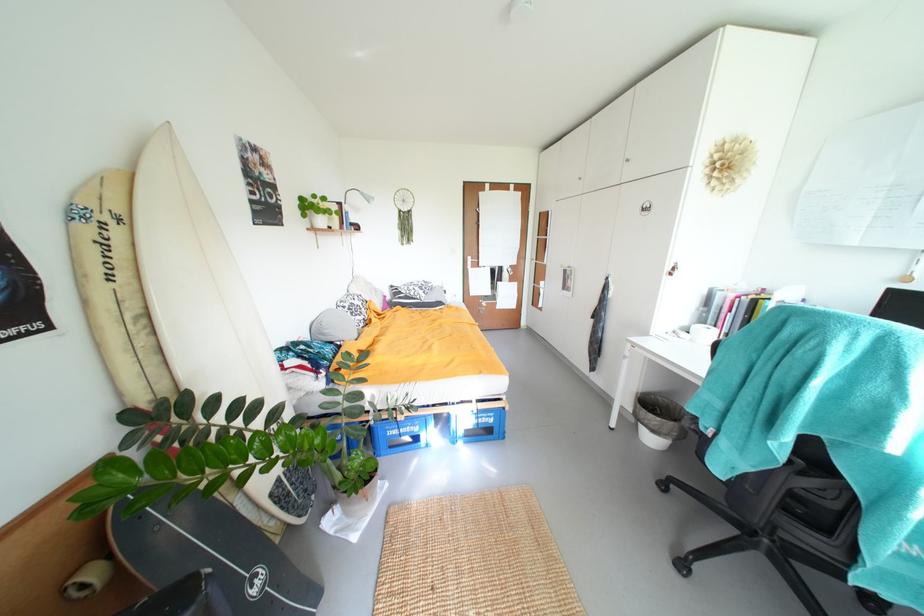
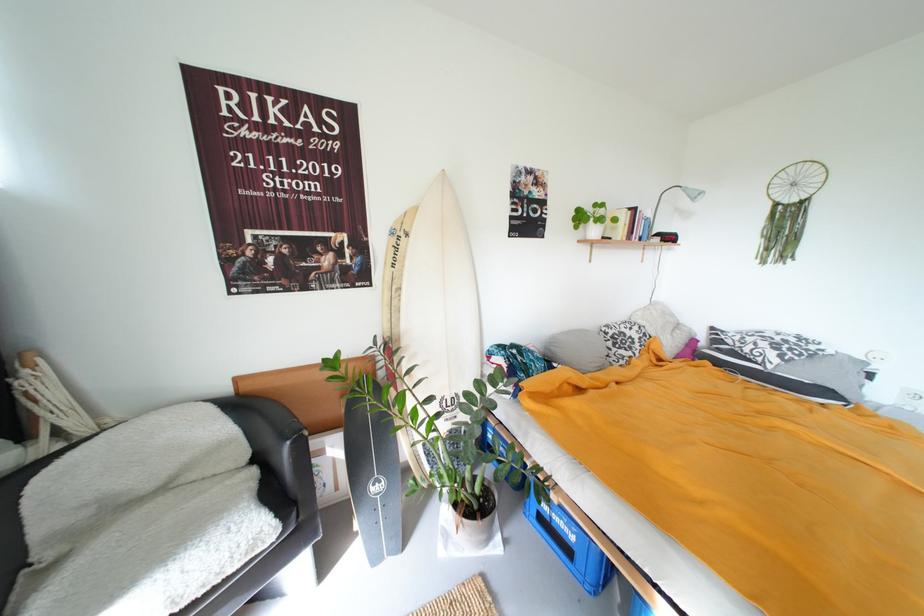
Find the pixel in the second image that matches [377,201] in the first image.

(703, 198)